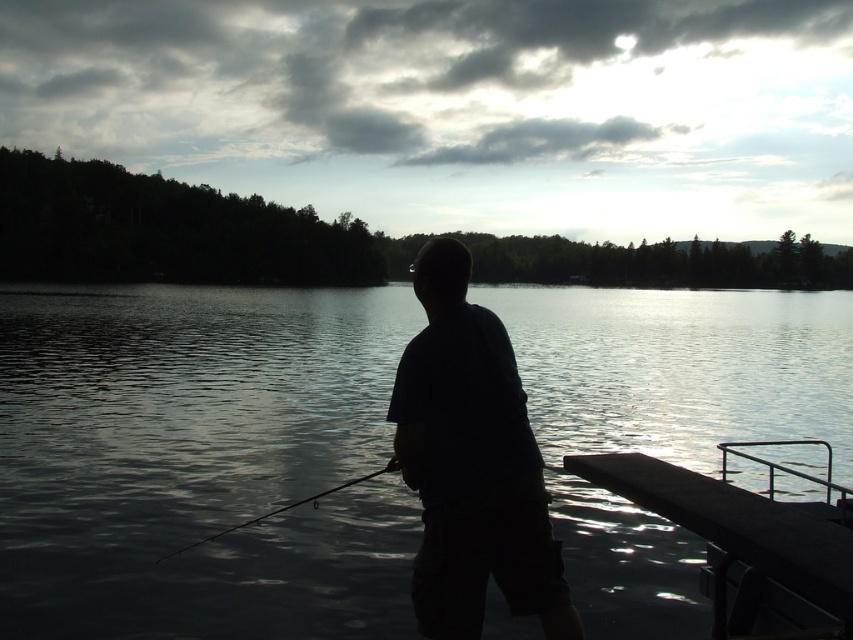
Where is `dark blue shirt at center`? dark blue shirt at center is located at coordinates (471, 464).

Who is higher up, dark blue shirt at center or smooth wood dock at lower right?

Positioned higher is dark blue shirt at center.

Does point (490, 492) come closer to viewer compared to point (825, 528)?

Yes, point (490, 492) is in front of point (825, 528).

I want to click on dark blue shirt at center, so click(x=471, y=464).

Can you confirm if transparent water at center is positioned to the right of silvery metallic fishing pole at lower center?

Yes, transparent water at center is to the right of silvery metallic fishing pole at lower center.

Between transparent water at center and silvery metallic fishing pole at lower center, which one has more height?

With more height is transparent water at center.

Describe the element at coordinates (200, 461) in the screenshot. I see `transparent water at center` at that location.

I want to click on transparent water at center, so click(x=200, y=461).

Is point (618, 442) more distant than point (454, 369)?

Yes.

Does transparent water at center have a greater height compared to dark blue shirt at center?

Indeed, transparent water at center has a greater height compared to dark blue shirt at center.

Does point (604, 612) lie behind point (434, 579)?

Yes.

The width and height of the screenshot is (853, 640). I want to click on transparent water at center, so click(x=200, y=461).